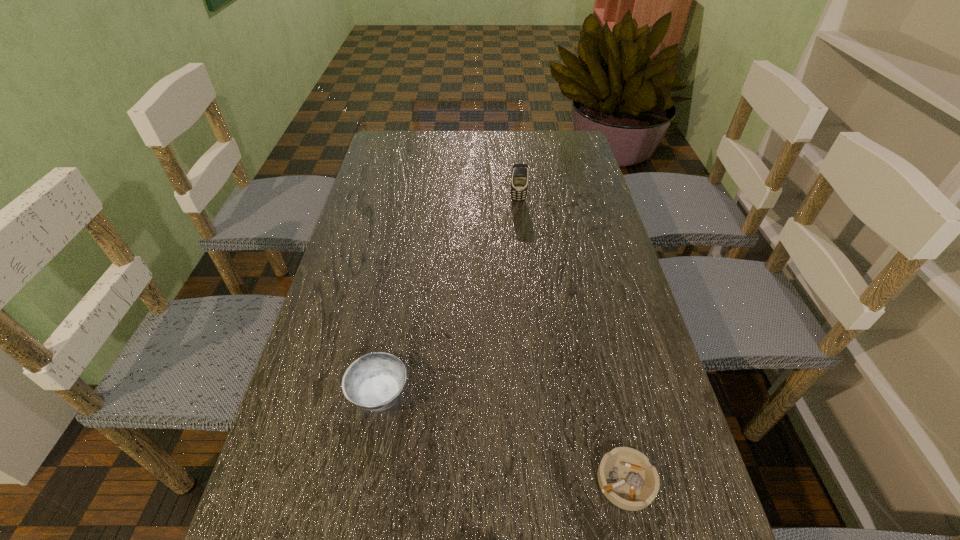
I want to click on object situated at the right edge, so click(x=627, y=479).

Where is `free space at the left edge of the desktop`? This screenshot has height=540, width=960. free space at the left edge of the desktop is located at coordinates (x=316, y=423).

Where is `free space at the right edge`? free space at the right edge is located at coordinates point(569,205).

Identify the location of free space between the shorter ashtray and the second nearest object. The height and width of the screenshot is (540, 960). pyautogui.click(x=502, y=437).

I want to click on unoccupied area between the right ashtray and the farther ashtray, so click(502, 437).

At what (x,y) coordinates should I click in order to perform the action: click on free point between the taller ashtray and the second object from right to left. Please return your answer as a coordinate pair (x, y). The height and width of the screenshot is (540, 960). Looking at the image, I should click on (448, 297).

In order to click on vacant point located between the tallest object and the second farthest object in this screenshot , I will do `click(448, 297)`.

Where is `free spot between the nearer ashtray and the farthest object`? The height and width of the screenshot is (540, 960). free spot between the nearer ashtray and the farthest object is located at coordinates (572, 341).

You are a GUI agent. You are given a task and a screenshot of the screen. Output one action in this format:
    pyautogui.click(x=<x>, y=<y>)
    Task: Click on the object that is the closest to the leftmost object
    
    Given the screenshot: What is the action you would take?
    pyautogui.click(x=627, y=479)

Point out which object is positioned as the nearest to the cellular telephone. Please provide its 2D coordinates. Your answer should be formatted as a tuple, i.e. [(x, y)], where the tuple contains the x and y coordinates of a point satisfying the conditions above.

[(374, 382)]